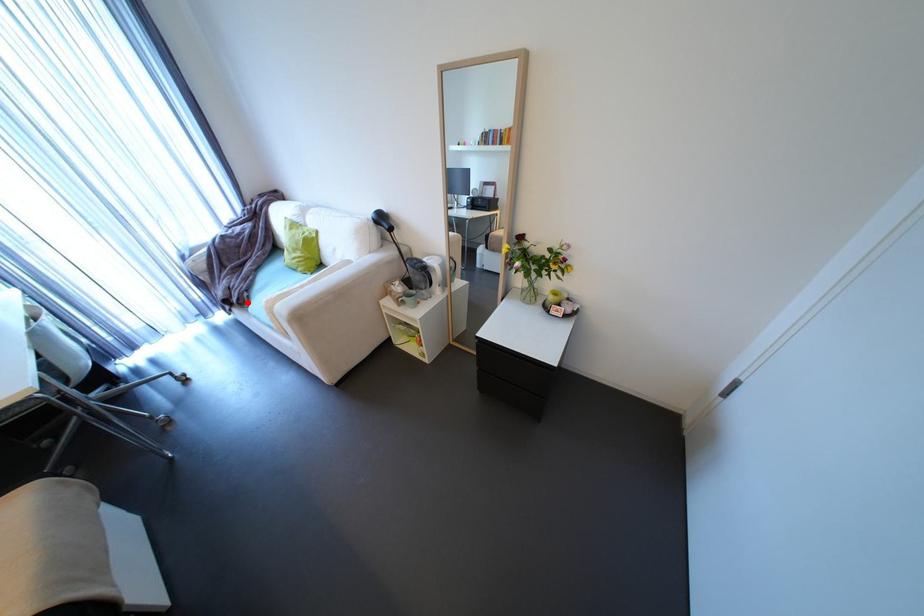
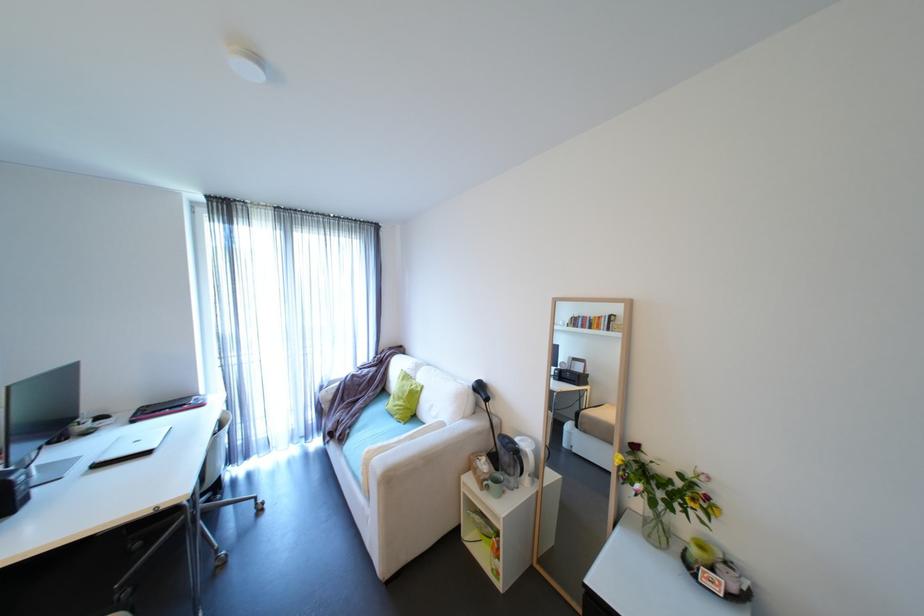
Find the pixel in the second image that matches the highlighted location in the first image.

(347, 438)